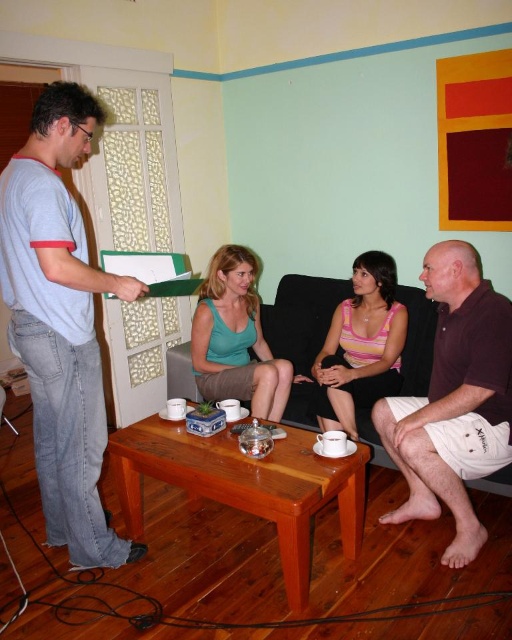
You are a delivery person who needs to place a package on the dark brown leather couch at center. However, the package is as wide as the green matte tank top at center. Will the package fit on the couch?

The dark brown leather couch at center is wider than the green matte tank top at center, so the package, which is as wide as the green matte tank top at center, will fit on the couch.

What are the coordinates of the dark brown leather couch at center?

The coordinates of the dark brown leather couch at center are point (x=302, y=316).

You are standing in the living room and want to place a small sticker on the light blue tshirt at left. The sticker must be placed exactly at the point with coordinates (60, 323). Can you confirm if this point is on the light blue tshirt at left?

Yes, the point (60, 323) is on the light blue tshirt at left, so the sticker can be placed there.